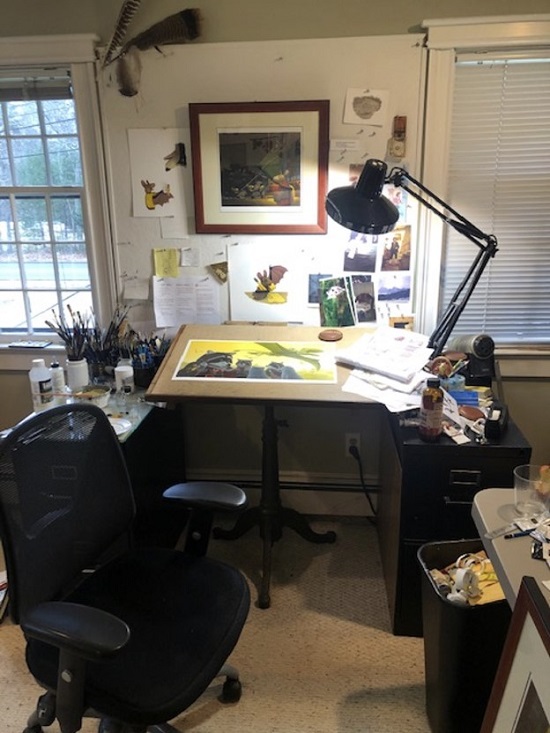
Where is `metal filing cabnet`? metal filing cabnet is located at coordinates (431, 485).